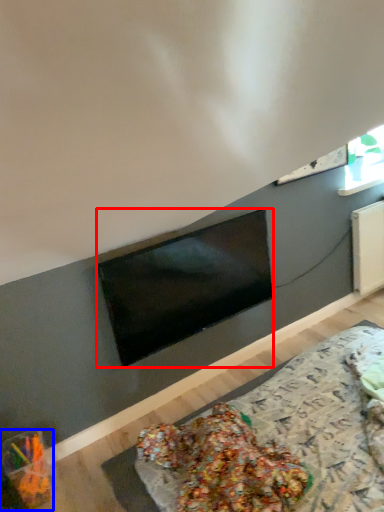
Question: Which point is closer to the camera, television (highlighted by a red box) or food (highlighted by a blue box)?

Choices:
 (A) television
 (B) food

Answer: (B)